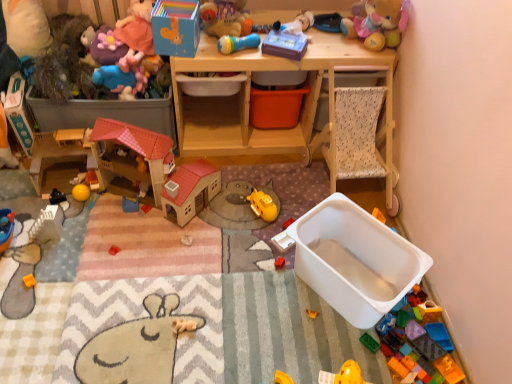
Locate an element on the screen. empty space that is in between yellow matte submarine at center, marked as the 9th toy in a left-to-right arrangement, and blue plastic toy at center, the 5th toy viewed from the left is located at coordinates pos(211,213).